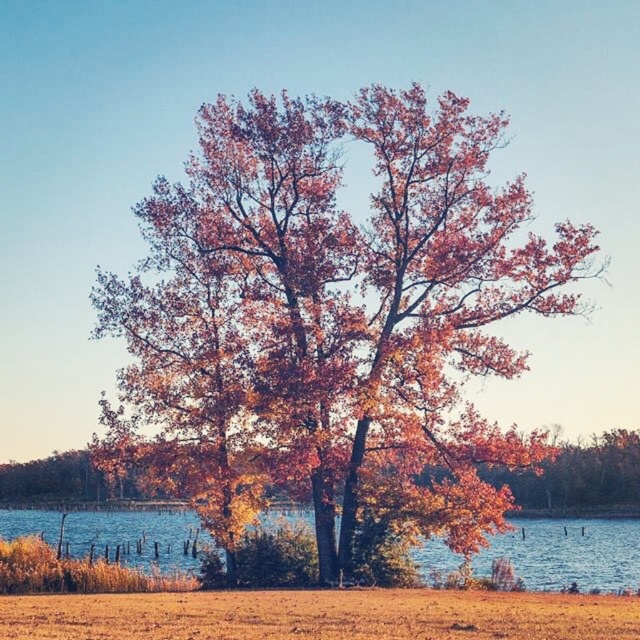
Question: Is brown grass at lower center to the right of blue water at lower center from the viewer's perspective?

Choices:
 (A) yes
 (B) no

Answer: (A)

Question: Which point is closer to the camera?

Choices:
 (A) blue water at lower center
 (B) autumn leaves wood at center
 (C) brown grass at lower center

Answer: (C)

Question: Which point is farther from the camera taking this photo?

Choices:
 (A) (104, 625)
 (B) (157, 564)
 (C) (333, 509)

Answer: (B)

Question: Considering the real-world distances, which object is closest to the blue water at lower center?

Choices:
 (A) brown grass at lower center
 (B) autumn leaves wood at center

Answer: (B)

Question: Does autumn leaves wood at center appear over blue water at lower center?

Choices:
 (A) no
 (B) yes

Answer: (B)

Question: Is brown grass at lower center to the left of blue water at lower center from the viewer's perspective?

Choices:
 (A) no
 (B) yes

Answer: (A)